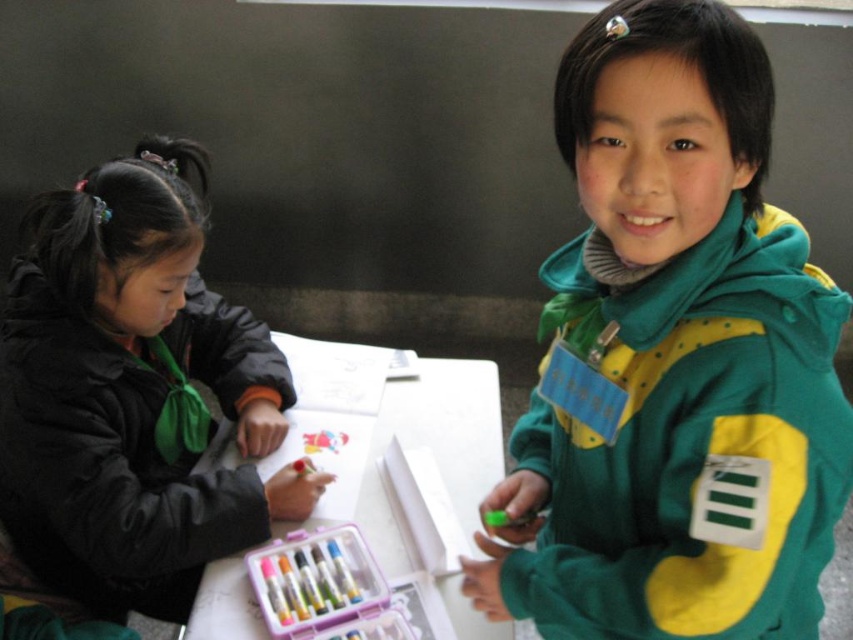
You are a teacher observing the children at the table. You need to hand out a new worksheet to the child wearing the black matte jacket at left. Where should you place the worksheet so it is closest to them without obstructing their view of the white paper at center?

Place the worksheet near the black matte jacket at left but below the white paper at center since the black matte jacket at left is above the white paper at center, so placing it below keeps it close without blocking their view.

You are a parent trying to organize your childrens jackets. The green fleece jacket at upper right and the black matte jacket at left are both on a table. If you want to place them side by side on a shelf that is 24 inches wide, will they fit without overlapping?

The green fleece jacket at upper right is 22.47 inches from black matte jacket at left. Since the total distance between them is less than the 24 inch shelf width, they can be placed side by side without overlapping.

You are a teacher organizing supplies for an art class. You have a storage box that can only fit items narrower than the white paper at center. Can the green fleece jacket at upper right fit into the storage box?

The green fleece jacket at upper right is narrower than the white paper at center, so it can fit into the storage box designed for items narrower than the white paper at center.